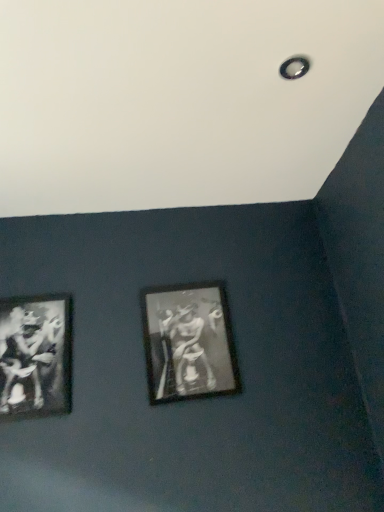
Question: Considering the relative positions of black matte picture frame at lower left, which is counted as the 2th picture frame, starting from the right, and black matte picture frame at center, arranged as the first picture frame when viewed from the right, in the image provided, is black matte picture frame at lower left, which is counted as the 2th picture frame, starting from the right, to the left of black matte picture frame at center, arranged as the first picture frame when viewed from the right, from the viewer's perspective?

Choices:
 (A) no
 (B) yes

Answer: (B)

Question: Is black matte picture frame at lower left, which is counted as the 2th picture frame, starting from the right, aimed at black matte picture frame at center, arranged as the first picture frame when viewed from the right?

Choices:
 (A) yes
 (B) no

Answer: (B)

Question: Can you see black matte picture frame at lower left, the first picture frame from the left, touching black matte picture frame at center, arranged as the first picture frame when viewed from the right?

Choices:
 (A) no
 (B) yes

Answer: (A)

Question: Would you consider black matte picture frame at lower left, which is counted as the 2th picture frame, starting from the right, to be distant from black matte picture frame at center, arranged as the first picture frame when viewed from the right?

Choices:
 (A) yes
 (B) no

Answer: (B)

Question: Considering the relative sizes of black matte picture frame at lower left, which is counted as the 2th picture frame, starting from the right, and black matte picture frame at center, positioned as the 2th picture frame in left-to-right order, in the image provided, is black matte picture frame at lower left, which is counted as the 2th picture frame, starting from the right, taller than black matte picture frame at center, positioned as the 2th picture frame in left-to-right order,?

Choices:
 (A) yes
 (B) no

Answer: (B)

Question: Considering the relative sizes of black matte picture frame at lower left, which is counted as the 2th picture frame, starting from the right, and black matte picture frame at center, arranged as the first picture frame when viewed from the right, in the image provided, is black matte picture frame at lower left, which is counted as the 2th picture frame, starting from the right, bigger than black matte picture frame at center, arranged as the first picture frame when viewed from the right,?

Choices:
 (A) no
 (B) yes

Answer: (A)

Question: Is black matte picture frame at center, arranged as the first picture frame when viewed from the right, placed right next to black matte picture frame at lower left, which is counted as the 2th picture frame, starting from the right?

Choices:
 (A) no
 (B) yes

Answer: (A)

Question: Considering the relative sizes of black matte picture frame at center, positioned as the 2th picture frame in left-to-right order, and black matte picture frame at lower left, which is counted as the 2th picture frame, starting from the right, in the image provided, is black matte picture frame at center, positioned as the 2th picture frame in left-to-right order, wider than black matte picture frame at lower left, which is counted as the 2th picture frame, starting from the right,?

Choices:
 (A) no
 (B) yes

Answer: (B)

Question: Is black matte picture frame at center, arranged as the first picture frame when viewed from the right, to the right of black matte picture frame at lower left, which is counted as the 2th picture frame, starting from the right, from the viewer's perspective?

Choices:
 (A) no
 (B) yes

Answer: (B)

Question: Is black matte picture frame at center, positioned as the 2th picture frame in left-to-right order, taller than black matte picture frame at lower left, which is counted as the 2th picture frame, starting from the right?

Choices:
 (A) no
 (B) yes

Answer: (B)

Question: Can you confirm if black matte picture frame at center, positioned as the 2th picture frame in left-to-right order, is positioned to the left of black matte picture frame at lower left, the first picture frame from the left?

Choices:
 (A) no
 (B) yes

Answer: (A)

Question: From the image's perspective, is black matte picture frame at center, arranged as the first picture frame when viewed from the right, under black matte picture frame at lower left, which is counted as the 2th picture frame, starting from the right?

Choices:
 (A) no
 (B) yes

Answer: (A)

Question: Considering the relative positions of black matte picture frame at lower left, which is counted as the 2th picture frame, starting from the right, and black matte picture frame at center, arranged as the first picture frame when viewed from the right, in the image provided, is black matte picture frame at lower left, which is counted as the 2th picture frame, starting from the right, to the left or to the right of black matte picture frame at center, arranged as the first picture frame when viewed from the right,?

Choices:
 (A) left
 (B) right

Answer: (A)